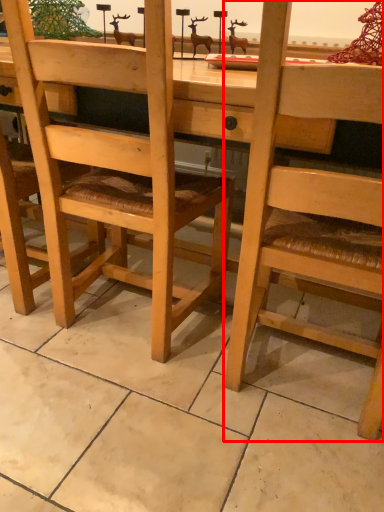
Question: From the image, what is the correct spatial relationship of chair (annotated by the red box) in relation to chair?

Choices:
 (A) right
 (B) left

Answer: (A)